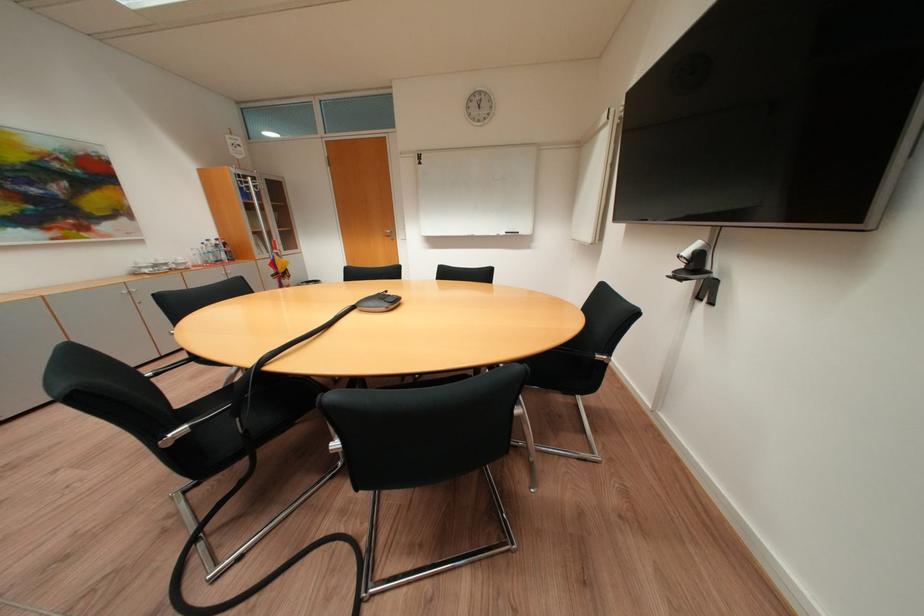
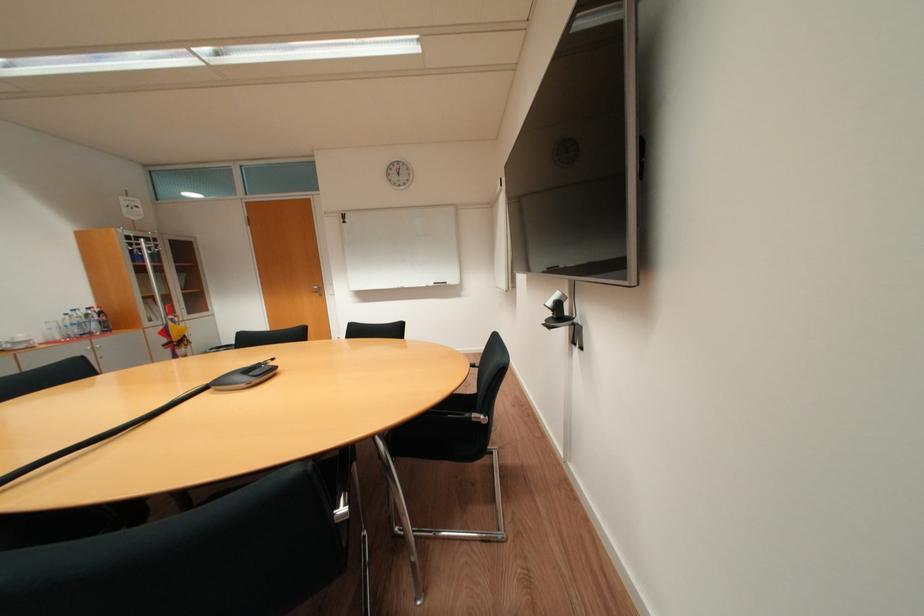
The point at (696, 254) is marked in the first image. Where is the corresponding point in the second image?

(558, 304)